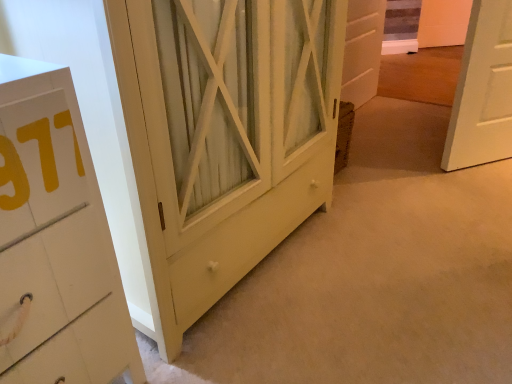
Find the location of a particular element. This screenshot has width=512, height=384. free space to the right of matte yellow cabinet at center is located at coordinates (401, 235).